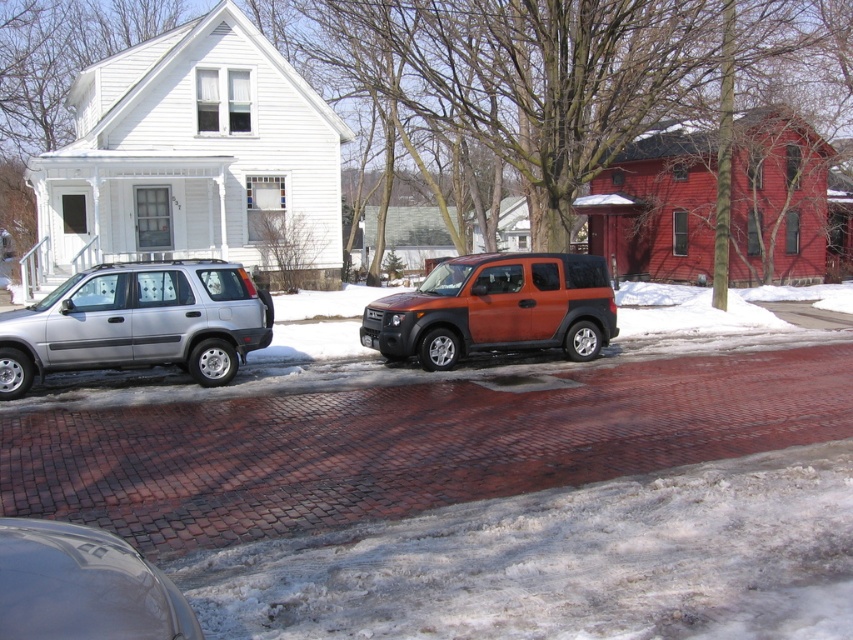
Which is above, orange matte suv at center or shiny black car at lower left?

orange matte suv at center

Is point (503, 348) closer to viewer compared to point (144, 596)?

No, it is behind (144, 596).

Does point (425, 323) come closer to viewer compared to point (28, 634)?

No, it is not.

At what (x,y) coordinates should I click in order to perform the action: click on orange matte suv at center. Please return your answer as a coordinate pair (x, y). Looking at the image, I should click on point(496,308).

Between silver metallic suv at left and orange matte suv at center, which one appears on the left side from the viewer's perspective?

From the viewer's perspective, silver metallic suv at left appears more on the left side.

Measure the distance between silver metallic suv at left and camera.

silver metallic suv at left is 9.99 meters from camera.

Describe the element at coordinates (138, 323) in the screenshot. I see `silver metallic suv at left` at that location.

Locate an element on the screen. silver metallic suv at left is located at coordinates (138, 323).

Who is taller, silver metallic suv at left or shiny black car at lower left?

silver metallic suv at left is taller.

Between point (114, 349) and point (126, 634), which one is positioned behind?

The point (114, 349) is behind.

Which is behind, point (257, 337) or point (109, 618)?

The point (257, 337) is more distant.

Where is `silver metallic suv at left`? silver metallic suv at left is located at coordinates (138, 323).